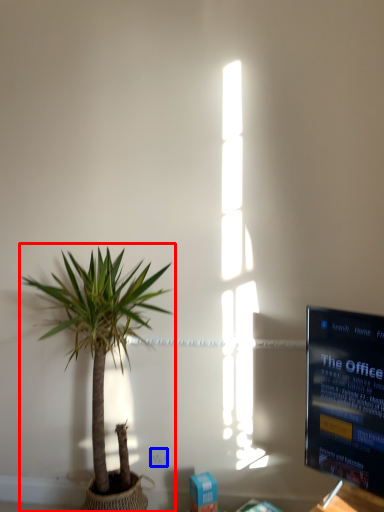
Question: Among these objects, which one is farthest to the camera, houseplant (highlighted by a red box) or electric outlet (highlighted by a blue box)?

Choices:
 (A) houseplant
 (B) electric outlet

Answer: (B)